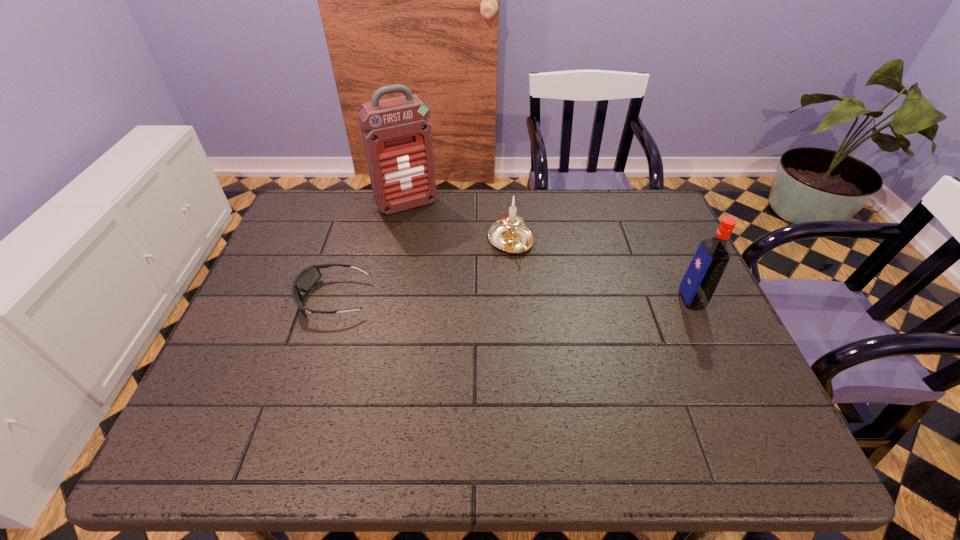
You are a GUI agent. You are given a task and a screenshot of the screen. Output one action in this format:
    pyautogui.click(x=<x>, y=<y>)
    Task: Click on the free space that satisfies the following two spatial constraints: 1. on the front side of the vodka; 2. on the front and back of the first-aid kit
    
    Given the screenshot: What is the action you would take?
    pyautogui.click(x=388, y=300)